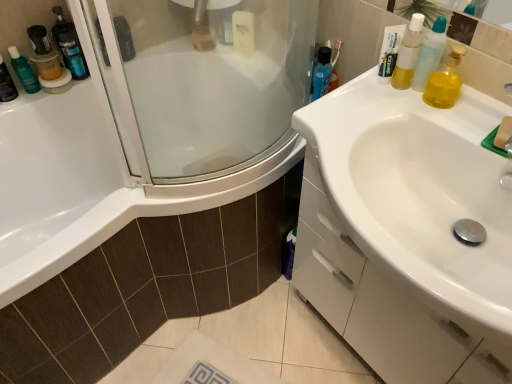
Identify the location of free space in front of translucent plastic mouthwash at upper right, which ranks as the fourth mouthwash in left-to-right order. click(415, 117).